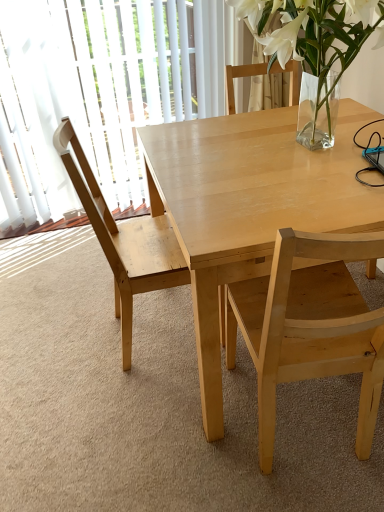
Question: Does light wood table at center appear on the left side of light wood chair at left, which is counted as the 2th chair, starting from the right?

Choices:
 (A) no
 (B) yes

Answer: (A)

Question: Is light wood table at center with light wood chair at left, which is the first chair from left to right?

Choices:
 (A) no
 (B) yes

Answer: (A)

Question: Considering the relative sizes of light wood table at center and light wood chair at left, which is the first chair from left to right, in the image provided, is light wood table at center bigger than light wood chair at left, which is the first chair from left to right,?

Choices:
 (A) no
 (B) yes

Answer: (B)

Question: Could you tell me if light wood table at center is turned towards light wood chair at left, which is counted as the 2th chair, starting from the right?

Choices:
 (A) no
 (B) yes

Answer: (B)

Question: Is light wood table at center outside of light wood chair at left, which is the first chair from left to right?

Choices:
 (A) yes
 (B) no

Answer: (A)

Question: Would you say light wood chair at center, which ranks as the 2th chair in left-to-right order, is inside or outside light wood chair at left, which is counted as the 2th chair, starting from the right?

Choices:
 (A) outside
 (B) inside

Answer: (A)

Question: Considering the positions of light wood chair at center, placed as the first chair when sorted from right to left, and light wood chair at left, which is the first chair from left to right, in the image, is light wood chair at center, placed as the first chair when sorted from right to left, bigger or smaller than light wood chair at left, which is the first chair from left to right,?

Choices:
 (A) big
 (B) small

Answer: (B)

Question: Is light wood chair at center, which ranks as the 2th chair in left-to-right order, wider or thinner than light wood chair at left, which is the first chair from left to right?

Choices:
 (A) wide
 (B) thin

Answer: (A)

Question: From the image's perspective, is light wood chair at center, placed as the first chair when sorted from right to left, above or below light wood chair at left, which is counted as the 2th chair, starting from the right?

Choices:
 (A) above
 (B) below

Answer: (B)

Question: From a real-world perspective, relative to transparent glass door at left, is clear glass vase at upper right vertically above or below?

Choices:
 (A) above
 (B) below

Answer: (A)

Question: Relative to transparent glass door at left, is clear glass vase at upper right in front or behind?

Choices:
 (A) behind
 (B) front

Answer: (B)

Question: Based on their sizes in the image, would you say clear glass vase at upper right is bigger or smaller than transparent glass door at left?

Choices:
 (A) small
 (B) big

Answer: (A)

Question: Considering the relative positions of clear glass vase at upper right and transparent glass door at left in the image provided, is clear glass vase at upper right to the left or to the right of transparent glass door at left?

Choices:
 (A) right
 (B) left

Answer: (A)

Question: Choose the correct answer: Is light wood chair at center, placed as the first chair when sorted from right to left, inside transparent glass door at left or outside it?

Choices:
 (A) outside
 (B) inside

Answer: (A)

Question: Is light wood chair at center, placed as the first chair when sorted from right to left, taller or shorter than transparent glass door at left?

Choices:
 (A) short
 (B) tall

Answer: (A)